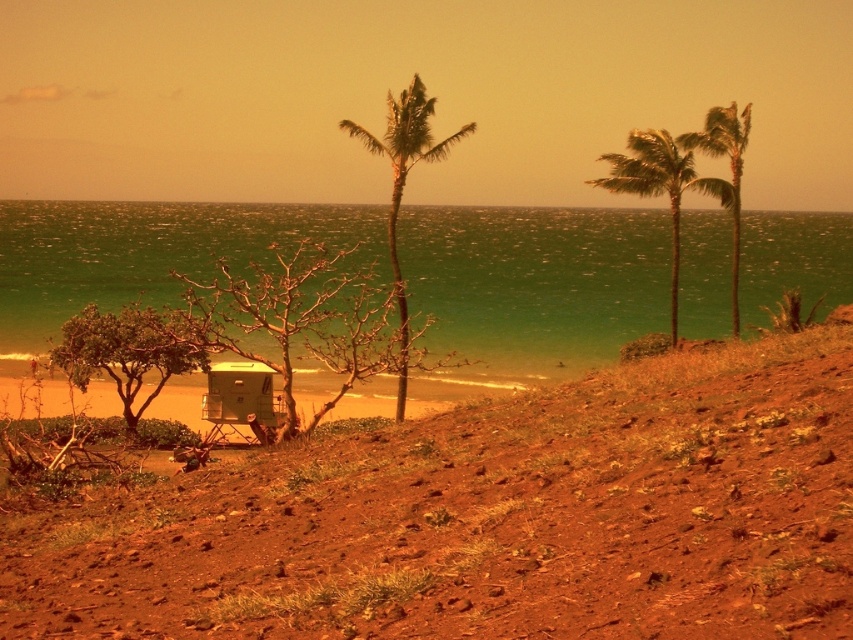
Does dirt/soil hillside at lower left have a lesser width compared to green leafy palm tree at upper right?

Incorrect, dirt/soil hillside at lower left's width is not less than green leafy palm tree at upper right's.

Is dirt/soil hillside at lower left wider than green leafy palm tree at upper right?

Correct, the width of dirt/soil hillside at lower left exceeds that of green leafy palm tree at upper right.

Who is more distant from viewer, (x=212, y=547) or (x=670, y=150)?

The point (x=670, y=150) is more distant.

Find the location of `dirt/soil hillside at lower left`. dirt/soil hillside at lower left is located at coordinates (488, 518).

Between dirt/soil hillside at lower left and green leafy tree at lower left, which one is positioned higher?

Positioned higher is green leafy tree at lower left.

Between point (500, 436) and point (62, 356), which one is positioned in front?

Point (500, 436) is more forward.

Is point (177, 532) farther from camera compared to point (114, 328)?

No, it is in front of (114, 328).

Identify the location of dirt/soil hillside at lower left. (488, 518).

Consider the image. Is green water at center above bare wood tree at center?

Indeed, green water at center is positioned over bare wood tree at center.

Is point (305, 232) less distant than point (258, 320)?

No.

Does point (514, 241) come farther from viewer compared to point (276, 348)?

That is True.

Find the location of `green water at center`. green water at center is located at coordinates (537, 280).